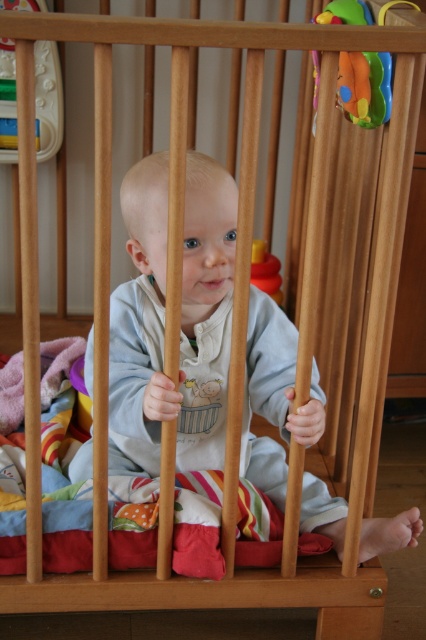
You are a parent checking the safety of the baby crib. The baby is currently holding the rubberized plastic rattle at upper left. You want to hand them the rubberized yellow toy at center. Can you reach it without climbing into the crib?

The rubberized plastic rattle at upper left and rubberized yellow toy at center are 28.61 inches apart. Since the average adult arm can reach about 24 inches, you may need to lean in or adjust your position to reach the rubberized yellow toy at center from the current position of the baby holding the rubberized plastic rattle at upper left.

You are a parent trying to locate your baby in the crib. You remember placing a rubberized plastic rattle at upper left. Where should you look in the crib to find the baby?

The baby is in the crib, so the rubberized plastic rattle at upper left is located at point (48,97) within the crib. Therefore, you should look near the upper left area of the crib to find the baby.

You are a parent checking the safety of the baby crib. You see the plastic colorful rattle at upper right and the rubberized yellow toy at center. Which toy should you be more concerned about in terms of size? Please explain.

The plastic colorful rattle at upper right is bigger than the rubberized yellow toy at center. Since it is larger, it might pose a choking hazard if the baby attempts to put it in their mouth, so you should be more concerned about the plastic colorful rattle at upper right.